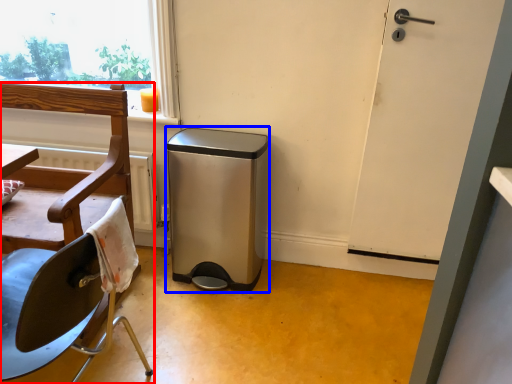
Question: Among these objects, which one is nearest to the camera, chair (highlighted by a red box) or dish washer (highlighted by a blue box)?

Choices:
 (A) chair
 (B) dish washer

Answer: (A)